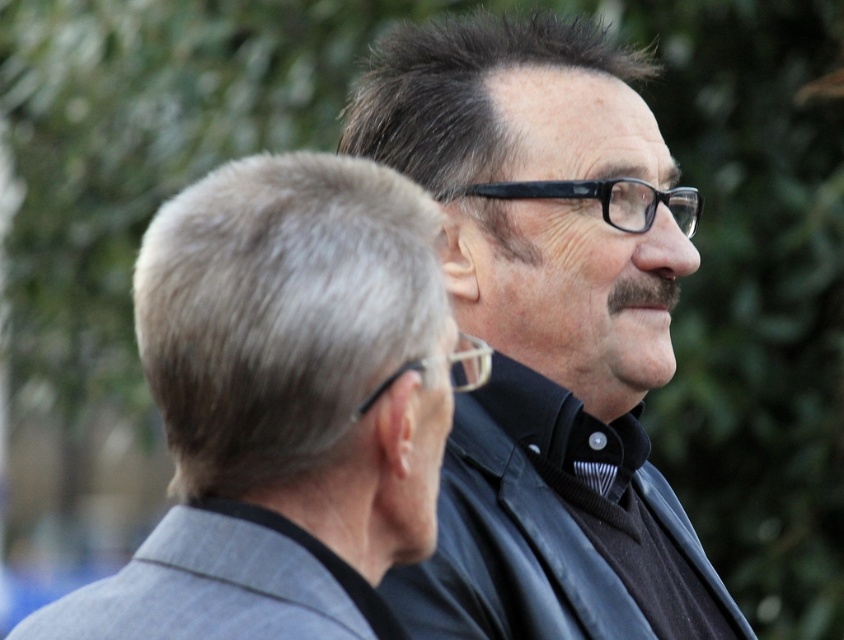
You are a photographer trying to capture a portrait of both the black matte shirt at center and the gray pinstripe suit at center. Since you want to ensure both are clearly visible in the frame, which one should you focus on first to ensure proper alignment?

The black matte shirt at center is positioned on the right side of gray pinstripe suit at center, so you should focus on the gray pinstripe suit at center first to ensure proper alignment since it is closer to the center of the frame.

You are a photographer setting up a shoot for two models wearing the black matte shirt at center and the gray pinstripe suit at center. The shoot requires the model in the smaller outfit to stand closer to the camera. Which model should you position closer?

The gray pinstripe suit at center is smaller than the black matte shirt at center, so the model wearing the gray pinstripe suit at center should be positioned closer to the camera.

You are a photographer adjusting your camera settings to focus on the two people in the image. Since both the black matte shirt at center and the gray pinstripe suit at center are in the frame, which one should you adjust the focus on first if you want to ensure the lower part of the scene is sharp?

The black matte shirt at center is below the gray pinstripe suit at center, so you should focus on the black matte shirt at center first to ensure the lower part of the scene is sharp.